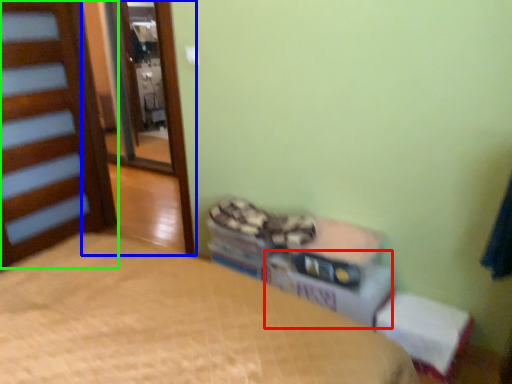
Question: Which object is positioned farthest from cardboard box (highlighted by a red box)? Select from screen door (highlighted by a blue box) and door (highlighted by a green box).

Choices:
 (A) screen door
 (B) door

Answer: (A)